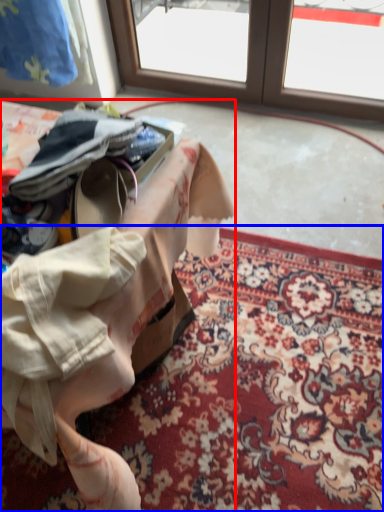
Question: Which of the following is the farthest to the observer, table (highlighted by a red box) or mat (highlighted by a blue box)?

Choices:
 (A) table
 (B) mat

Answer: (B)